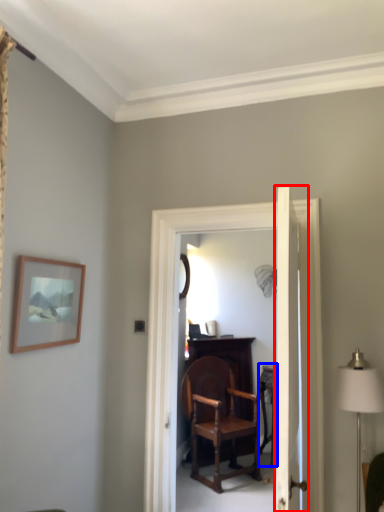
Question: Which object is closer to the camera taking this photo, door (highlighted by a red box) or table (highlighted by a blue box)?

Choices:
 (A) door
 (B) table

Answer: (A)